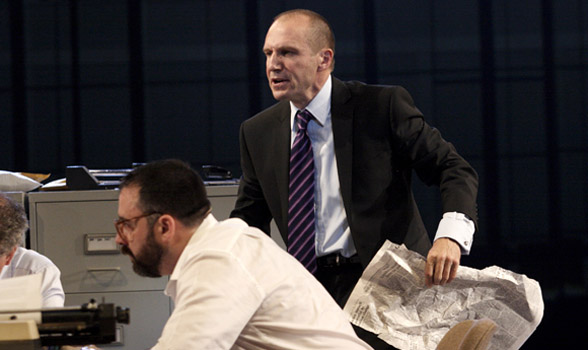
Find where you'd open a drawer in the image. Your answer should be formatted as a list of tuples, i.e. [(x1, y1), (x2, y2), ...], where each tuple contains the x and y coordinates of a point satisfying the conditions above.

[(105, 268)]